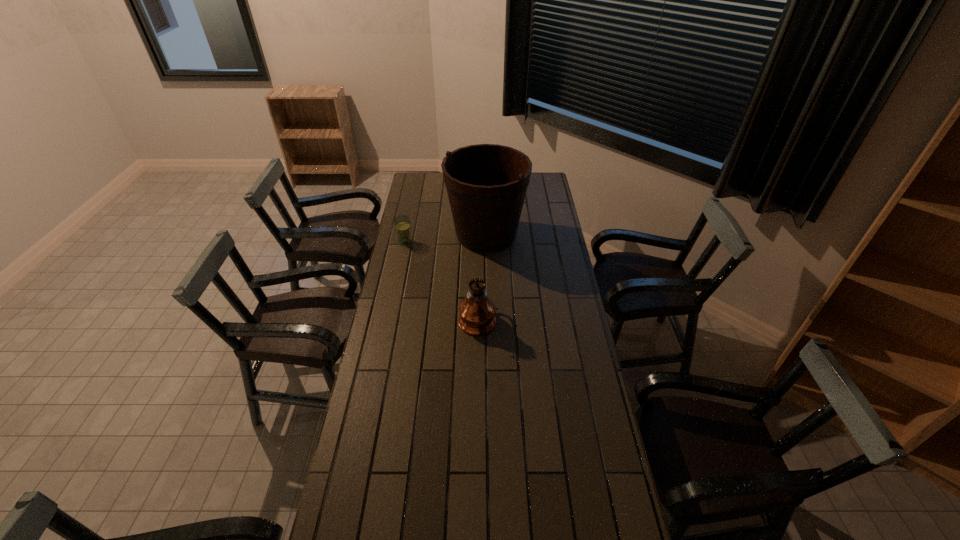
Select which object appears as the closest to the glass. Please provide its 2D coordinates. Your answer should be formatted as a tuple, i.e. [(x, y)], where the tuple contains the x and y coordinates of a point satisfying the conditions above.

[(486, 184)]

Choose which object is the nearest neighbor to the shortest object. Please provide its 2D coordinates. Your answer should be formatted as a tuple, i.e. [(x, y)], where the tuple contains the x and y coordinates of a point satisfying the conditions above.

[(486, 184)]